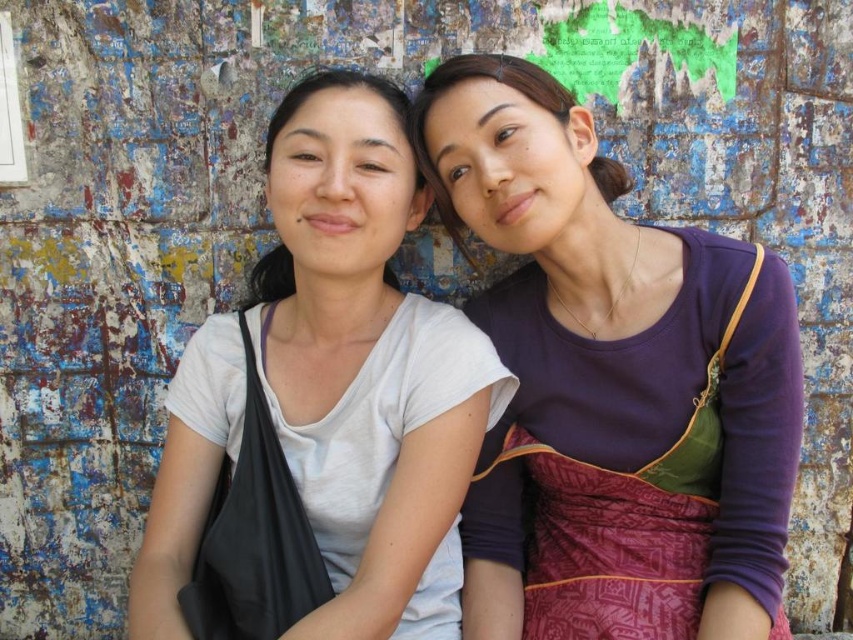
You are an artist planning to paint a mural on the wall where the matte purple dress at upper right and the white matte shirt at center are located. You need to know which object takes up more space on the wall. Which one should you consider larger?

The matte purple dress at upper right is bigger than the white matte shirt at center, so you should consider the matte purple dress at upper right as the larger one when planning your mural.